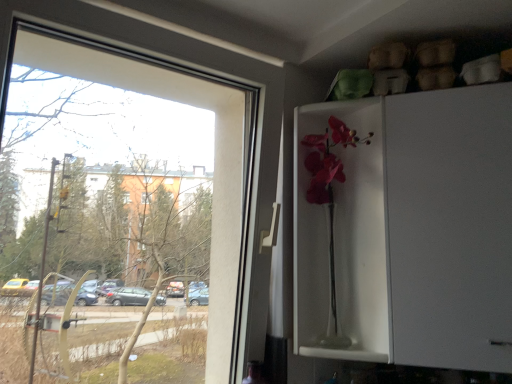
The width and height of the screenshot is (512, 384). Find the location of `transparent glass window at left`. transparent glass window at left is located at coordinates (168, 60).

At what (x,y) coordinates should I click in order to perform the action: click on matte glass vase at center. Please return your answer as a coordinate pair (x, y). This screenshot has height=384, width=512. Looking at the image, I should click on (342, 232).

Describe the element at coordinates (342, 232) in the screenshot. I see `matte glass vase at center` at that location.

Locate an element on the screen. This screenshot has width=512, height=384. white glossy cabinet at upper right is located at coordinates (412, 231).

You are a GUI agent. You are given a task and a screenshot of the screen. Output one action in this format:
    pyautogui.click(x=<x>, y=<y>)
    Task: Click on the transparent glass window at left
    
    Given the screenshot: What is the action you would take?
    pyautogui.click(x=168, y=60)

Considering the relative sizes of white glossy cabinet at upper right and matte glass vase at center in the image provided, is white glossy cabinet at upper right bigger than matte glass vase at center?

Indeed, white glossy cabinet at upper right has a larger size compared to matte glass vase at center.

Can you tell me how much white glossy cabinet at upper right and matte glass vase at center differ in facing direction?

The angular difference between white glossy cabinet at upper right and matte glass vase at center is 12.9 degrees.

Considering the positions of objects white glossy cabinet at upper right and matte glass vase at center in the image provided, who is behind, white glossy cabinet at upper right or matte glass vase at center?

matte glass vase at center is further away from the camera.

Considering the positions of objects white glossy cabinet at upper right and matte glass vase at center in the image provided, who is more to the right, white glossy cabinet at upper right or matte glass vase at center?

Positioned to the right is white glossy cabinet at upper right.

Which is more to the left, transparent glass window at left or matte glass vase at center?

From the viewer's perspective, transparent glass window at left appears more on the left side.

Is transparent glass window at left facing away from matte glass vase at center?

No, transparent glass window at left is not facing the opposite direction of matte glass vase at center.

Are transparent glass window at left and matte glass vase at center beside each other?

transparent glass window at left and matte glass vase at center are not in contact.

I want to click on screen door behind the transparent glass window at left, so click(x=342, y=232).

Can you tell me how much matte glass vase at center and white glossy cabinet at upper right differ in facing direction?

The angle between the facing direction of matte glass vase at center and the facing direction of white glossy cabinet at upper right is 12.9 degrees.

Consider the image. Is matte glass vase at center taller than white glossy cabinet at upper right?

No, matte glass vase at center is not taller than white glossy cabinet at upper right.

Where is `fridge lying on the right of matte glass vase at center`? This screenshot has height=384, width=512. fridge lying on the right of matte glass vase at center is located at coordinates (412, 231).

From a real-world perspective, who is located lower, matte glass vase at center or white glossy cabinet at upper right?

matte glass vase at center, from a real-world perspective.

Considering the relative positions of white glossy cabinet at upper right and transparent glass window at left in the image provided, is white glossy cabinet at upper right to the left of transparent glass window at left from the viewer's perspective?

Incorrect, white glossy cabinet at upper right is not on the left side of transparent glass window at left.

Is white glossy cabinet at upper right positioned with its back to transparent glass window at left?

No, transparent glass window at left is not at the back of white glossy cabinet at upper right.

Considering the sizes of objects white glossy cabinet at upper right and transparent glass window at left in the image provided, who is bigger, white glossy cabinet at upper right or transparent glass window at left?

Bigger between the two is white glossy cabinet at upper right.

Is white glossy cabinet at upper right outside of transparent glass window at left?

Yes, white glossy cabinet at upper right is located beyond the bounds of transparent glass window at left.

Is point (62, 16) closer or farther from the camera than point (435, 342)?

Point (62, 16) is closer to the camera than point (435, 342).

Is transparent glass window at left smaller than white glossy cabinet at upper right?

Indeed, transparent glass window at left has a smaller size compared to white glossy cabinet at upper right.

From the image's perspective, would you say transparent glass window at left is shown under white glossy cabinet at upper right?

No, from the image's perspective, transparent glass window at left is not below white glossy cabinet at upper right.

Between transparent glass window at left and white glossy cabinet at upper right, which one has less height?

white glossy cabinet at upper right.

Considering the points (348, 196) and (84, 21), which point is in front, point (348, 196) or point (84, 21)?

Positioned in front is point (84, 21).

Would you say matte glass vase at center is a long distance from transparent glass window at left?

No, matte glass vase at center is in close proximity to transparent glass window at left.

Would you say matte glass vase at center is to the left or to the right of transparent glass window at left in the picture?

Based on their positions, matte glass vase at center is located to the right of transparent glass window at left.

Looking at this image, between matte glass vase at center and transparent glass window at left, which one has less height?

matte glass vase at center.

Locate an element on the screen. Image resolution: width=512 pixels, height=384 pixels. screen door behind the white glossy cabinet at upper right is located at coordinates (342, 232).

Image resolution: width=512 pixels, height=384 pixels. In order to click on screen door below the transparent glass window at left (from the image's perspective) in this screenshot , I will do `click(342, 232)`.

Based on their spatial positions, is white glossy cabinet at upper right or transparent glass window at left further from matte glass vase at center?

transparent glass window at left is positioned further to the anchor matte glass vase at center.

When comparing their distances from transparent glass window at left, does white glossy cabinet at upper right or matte glass vase at center seem closer?

Based on the image, matte glass vase at center appears to be nearer to transparent glass window at left.

Considering their positions, is transparent glass window at left positioned further to white glossy cabinet at upper right than matte glass vase at center?

Based on the image, transparent glass window at left appears to be further to white glossy cabinet at upper right.

Considering their positions, is matte glass vase at center positioned further to transparent glass window at left than white glossy cabinet at upper right?

Based on the image, white glossy cabinet at upper right appears to be further to transparent glass window at left.

Looking at the image, which one is located closer to white glossy cabinet at upper right, matte glass vase at center or transparent glass window at left?

Among the two, matte glass vase at center is located nearer to white glossy cabinet at upper right.

Estimate the real-world distances between objects in this image. Which object is further from matte glass vase at center, transparent glass window at left or white glossy cabinet at upper right?

transparent glass window at left is positioned further to the anchor matte glass vase at center.

The width and height of the screenshot is (512, 384). What are the coordinates of `screen door located between transparent glass window at left and white glossy cabinet at upper right in the left-right direction` in the screenshot? It's located at (342, 232).